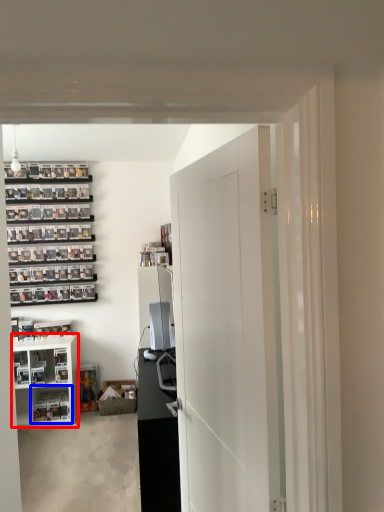
Question: Which object is further to the camera taking this photo, cabinetry (highlighted by a red box) or shelf (highlighted by a blue box)?

Choices:
 (A) cabinetry
 (B) shelf

Answer: (B)